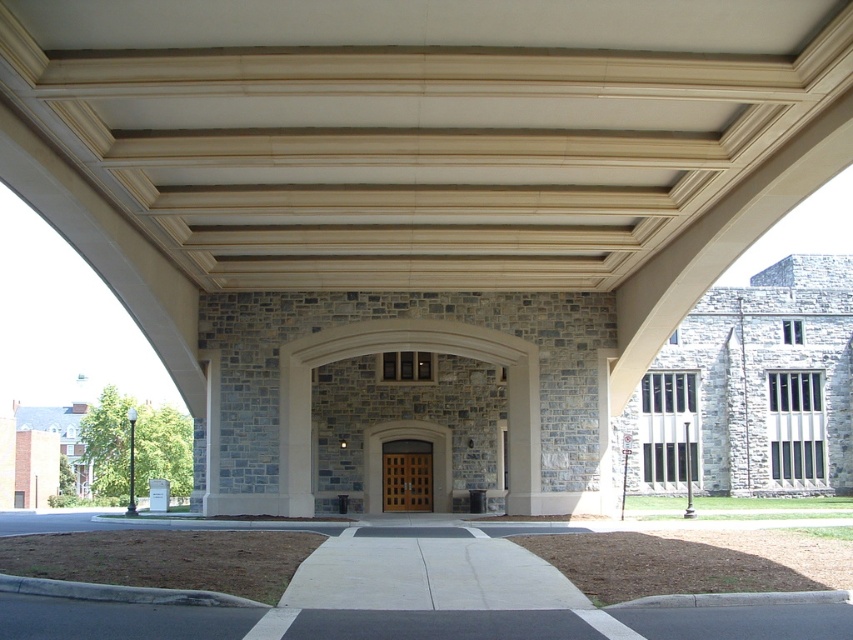
Does wooden door at center come behind brown wooden door at center?

No, it is not.

At what (x,y) coordinates should I click in order to perform the action: click on wooden door at center. Please return your answer as a coordinate pair (x, y). Image resolution: width=853 pixels, height=640 pixels. Looking at the image, I should click on pos(407,438).